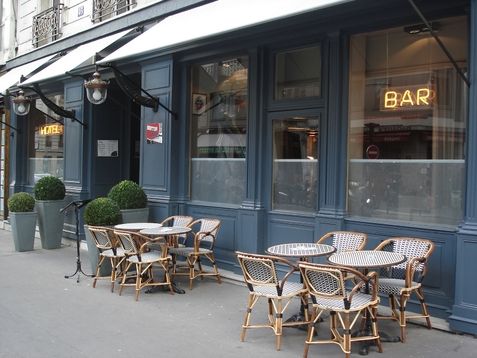
Where is `chairs`? The image size is (477, 358). chairs is located at coordinates (103, 244), (142, 261), (176, 223), (206, 228), (259, 292), (334, 305), (349, 246), (404, 249).